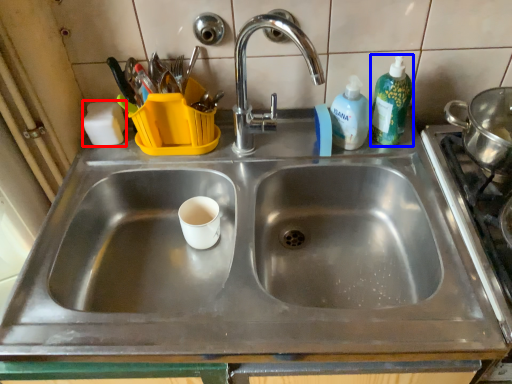
Question: Among these objects, which one is nearest to the camera, soap (highlighted by a red box) or cleaning product (highlighted by a blue box)?

Choices:
 (A) soap
 (B) cleaning product

Answer: (B)